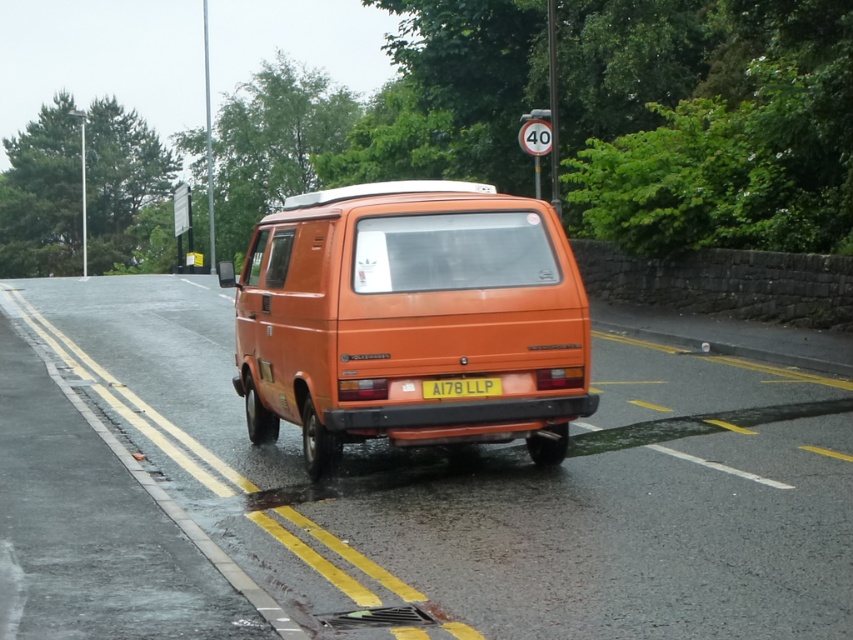
You are a delivery driver who needs to park your vehicle exactly at the point marked by point (410,320). Given that the orange matte van at center is already occupying that spot, can you park your vehicle there?

The point (410,320) is on the orange matte van at center, so you cannot park there as the van is already occupying that spot.

You are a delivery driver who needs to park your truck next to the orange matte van at center and the yellow matte license plate at center. Considering the road has double yellow lines, can you park your truck here?

The orange matte van at center is parked on the road, and the yellow matte license plate at center is part of the van. Since the road has double yellow lines, which typically indicate no parking, you cannot park your truck here.

You are a photographer standing at the position of the camera. You want to place a small marker at both point (248, 348) and point (488, 384). Which point should you place first if you want to place the markers starting from the closest one to the camera?

You should place the marker at point (488, 384) first because it is closer to the camera than point (248, 348).